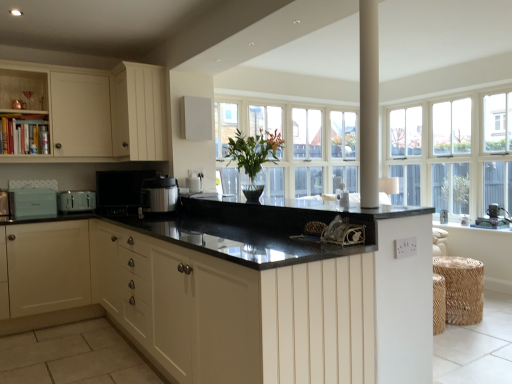
Question: Which direction should I rotate to face matte black pressure cooker at center, which is counted as the fourth appliance, starting from the left, — up or down?

Choices:
 (A) up
 (B) down

Answer: (A)

Question: Can you confirm if white matte speaker at upper center, acting as the 1th appliance starting from the right, is shorter than matte silver toaster at left, which is the 4th appliance in right-to-left order?

Choices:
 (A) yes
 (B) no

Answer: (B)

Question: From a real-world perspective, is white matte speaker at upper center, positioned as the fifth appliance in left-to-right order, located beneath matte silver toaster at left, which is the 4th appliance in right-to-left order?

Choices:
 (A) no
 (B) yes

Answer: (A)

Question: Is white matte speaker at upper center, positioned as the fifth appliance in left-to-right order, bigger than matte silver toaster at left, which is the 4th appliance in right-to-left order?

Choices:
 (A) yes
 (B) no

Answer: (B)

Question: Does white matte speaker at upper center, acting as the 1th appliance starting from the right, contain matte silver toaster at left, which is the 2th appliance in left-to-right order?

Choices:
 (A) no
 (B) yes

Answer: (A)

Question: Are white matte speaker at upper center, acting as the 1th appliance starting from the right, and matte silver toaster at left, which is the 4th appliance in right-to-left order, far apart?

Choices:
 (A) no
 (B) yes

Answer: (B)

Question: Are white matte speaker at upper center, positioned as the fifth appliance in left-to-right order, and matte silver toaster at left, which is the 2th appliance in left-to-right order, beside each other?

Choices:
 (A) no
 (B) yes

Answer: (A)

Question: Considering the relative sizes of woven straw stool at lower right and black matte microwave at center, placed as the 3th appliance when sorted from left to right, in the image provided, is woven straw stool at lower right smaller than black matte microwave at center, placed as the 3th appliance when sorted from left to right,?

Choices:
 (A) yes
 (B) no

Answer: (B)

Question: Is woven straw stool at lower right closer to camera compared to black matte microwave at center, arranged as the third appliance when viewed from the right?

Choices:
 (A) yes
 (B) no

Answer: (A)

Question: Can you confirm if woven straw stool at lower right is positioned to the right of black matte microwave at center, arranged as the third appliance when viewed from the right?

Choices:
 (A) yes
 (B) no

Answer: (A)

Question: Is woven straw stool at lower right facing towards black matte microwave at center, arranged as the third appliance when viewed from the right?

Choices:
 (A) no
 (B) yes

Answer: (A)

Question: From a real-world perspective, is woven straw stool at lower right beneath black matte microwave at center, placed as the 3th appliance when sorted from left to right?

Choices:
 (A) yes
 (B) no

Answer: (A)

Question: Can you confirm if woven straw stool at lower right is bigger than black matte microwave at center, placed as the 3th appliance when sorted from left to right?

Choices:
 (A) no
 (B) yes

Answer: (B)

Question: Are green glossy vase at center and white textured window sill at right beside each other?

Choices:
 (A) yes
 (B) no

Answer: (B)